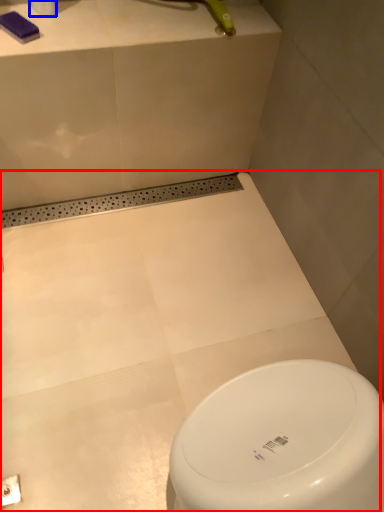
Question: Which object is closer to the camera taking this photo, bath (highlighted by a red box) or toilet paper (highlighted by a blue box)?

Choices:
 (A) bath
 (B) toilet paper

Answer: (A)